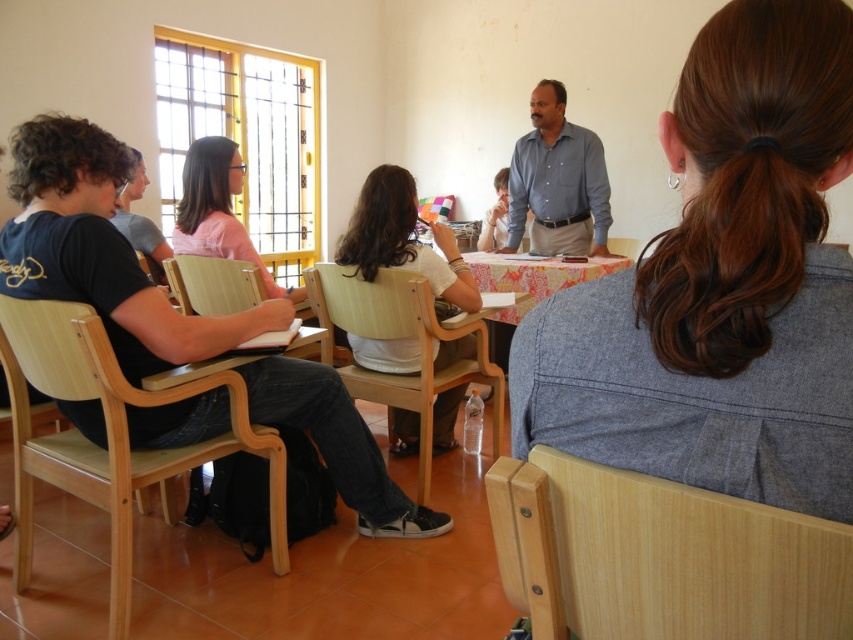
Is wooden chair at center taller than blue shirt at center?

In fact, wooden chair at center may be shorter than blue shirt at center.

Which is in front, point (480, 342) or point (566, 204)?

Point (480, 342)

Is point (425, 392) positioned in front of point (515, 177)?

Yes, it is.

Where is `wooden chair at center`? This screenshot has width=853, height=640. wooden chair at center is located at coordinates (403, 337).

Is light wood chair at lower right shorter than printed fabric table at center?

Yes, light wood chair at lower right is shorter than printed fabric table at center.

Measure the distance between light wood chair at lower right and camera.

23.56 inches

Locate an element on the screen. light wood chair at lower right is located at coordinates (660, 557).

Which is more to the right, light wood chair at lower left or blue shirt at center?

Positioned to the right is blue shirt at center.

Who is more forward, (16,332) or (544,132)?

Point (16,332)

Which is in front, point (18, 492) or point (541, 188)?

Point (18, 492) is in front.

At what (x,y) coordinates should I click in order to perform the action: click on light wood chair at lower left. Please return your answer as a coordinate pair (x, y). The width and height of the screenshot is (853, 640). Looking at the image, I should click on (109, 436).